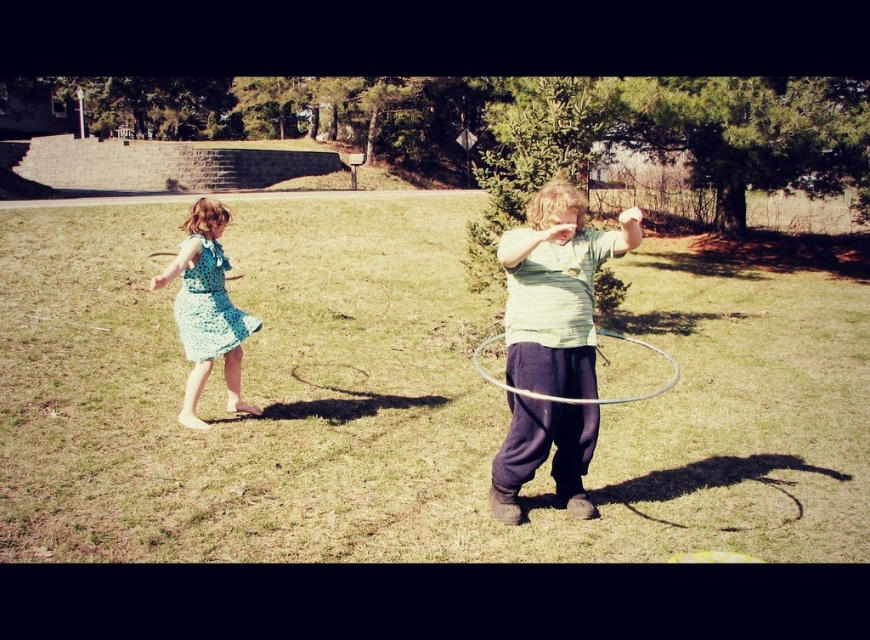
You are a photographer trying to capture a photo of the silver metallic hula hoop at center and the light green fabric shirt at center. If you want to position them side by side in the frame, which object should you move to the right to make space?

The light green fabric shirt at center is to the left of the silver metallic hula hoop at center. To position them side by side, you should move the light green fabric shirt at center to the right so it aligns next to the silver metallic hula hoop at center.